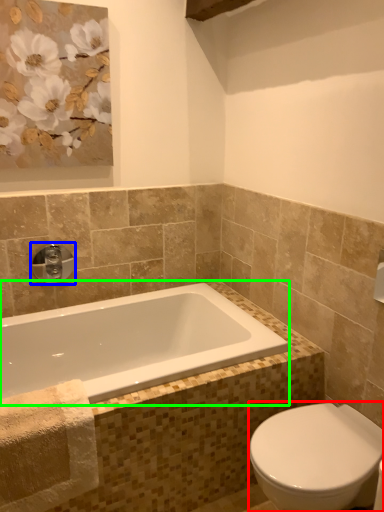
Question: Based on their relative distances, which object is farther from bidet (highlighted by a red box)? Choose from tap (highlighted by a blue box) and bathtub (highlighted by a green box).

Choices:
 (A) tap
 (B) bathtub

Answer: (A)